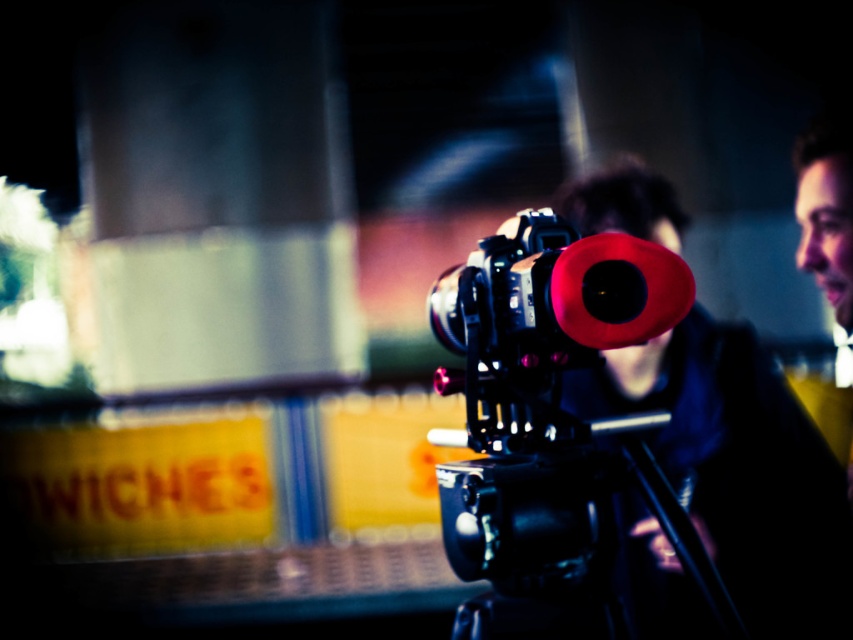
Question: Which object appears closest to the camera in this image?

Choices:
 (A) matte black camera at center
 (B) smooth black jacket at center

Answer: (A)

Question: Can you confirm if black matte tripod at center is smaller than matte black camera at center?

Choices:
 (A) yes
 (B) no

Answer: (B)

Question: Which point is farther to the camera?

Choices:
 (A) (637, 419)
 (B) (584, 285)

Answer: (A)

Question: Is smooth black jacket at center further to camera compared to matte black camera at center?

Choices:
 (A) no
 (B) yes

Answer: (B)

Question: Which object is positioned farthest from the matte black camera at center?

Choices:
 (A) black matte tripod at center
 (B) smooth black jacket at center

Answer: (B)

Question: Is smooth black jacket at center closer to camera compared to matte black camera at center?

Choices:
 (A) no
 (B) yes

Answer: (A)